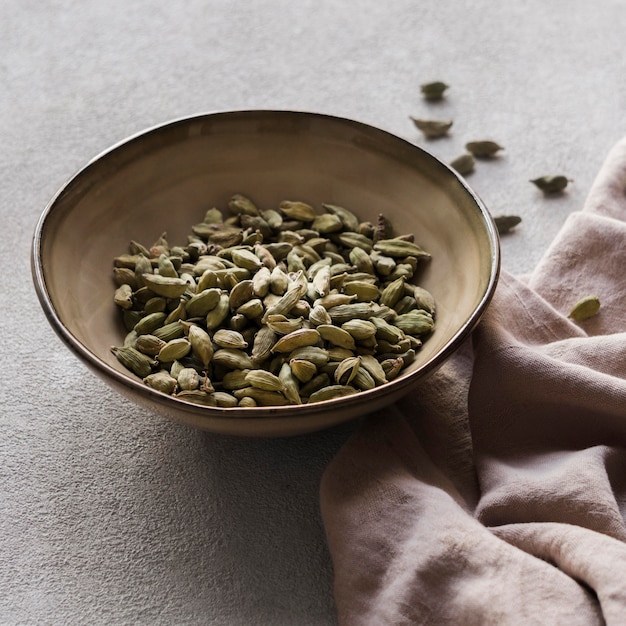
What are the coordinates of `dark brown rim of bowl` in the screenshot? It's located at (49, 312), (267, 409), (495, 245).